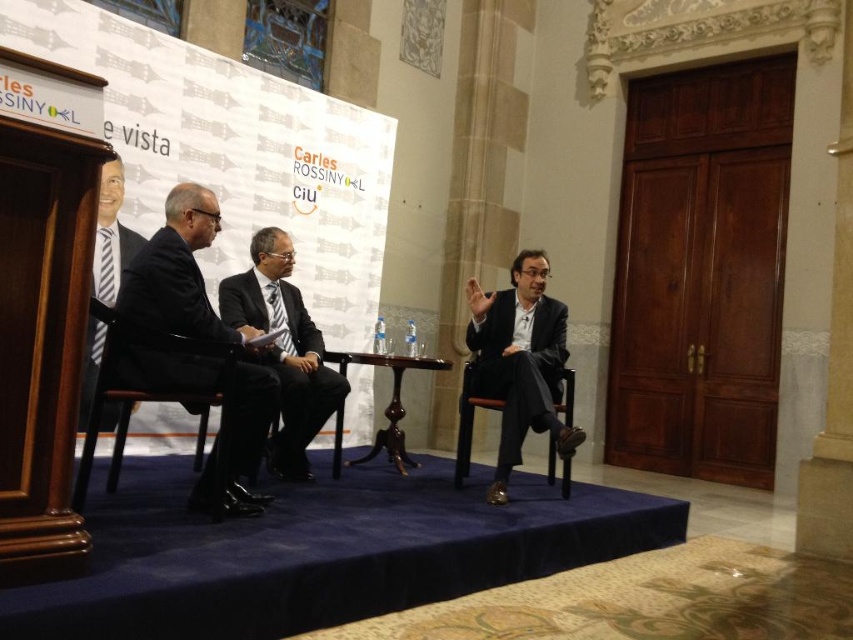
Can you confirm if matte black suit at center is positioned to the left of black leather chair at center?

In fact, matte black suit at center is to the right of black leather chair at center.

Does matte black suit at center have a lesser height compared to black leather chair at center?

Incorrect, matte black suit at center's height does not fall short of black leather chair at center's.

Who is more distant from viewer, [554,312] or [289,413]?

The point [554,312] is behind.

Identify the location of matte black suit at center. (520, 360).

Between dark suit at left and black leather chair at left, which one is positioned higher?

dark suit at left is above.

How distant is dark suit at left from black leather chair at left?

The distance of dark suit at left from black leather chair at left is 5.36 inches.

What do you see at coordinates (178, 273) in the screenshot? I see `dark suit at left` at bounding box center [178, 273].

The image size is (853, 640). What are the coordinates of `dark suit at left` in the screenshot? It's located at (178, 273).

Can you confirm if matte black suit at center is positioned to the right of dark suit at center?

Correct, you'll find matte black suit at center to the right of dark suit at center.

Is matte black suit at center shorter than dark suit at center?

Yes, matte black suit at center is shorter than dark suit at center.

You are a GUI agent. You are given a task and a screenshot of the screen. Output one action in this format:
    pyautogui.click(x=<x>, y=<y>)
    Task: Click on the matte black suit at center
    
    Given the screenshot: What is the action you would take?
    pyautogui.click(x=520, y=360)